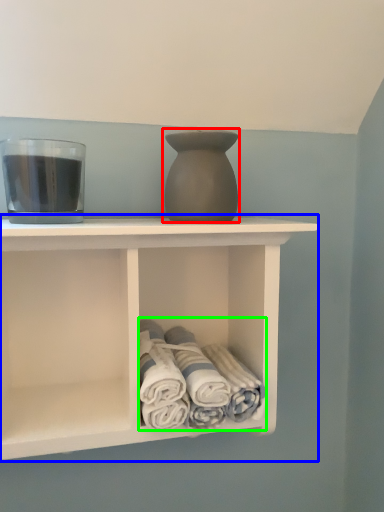
Question: Which object is the farthest from vase (highlighted by a red box)? Choose among these: shelf (highlighted by a blue box) or bath towel (highlighted by a green box).

Choices:
 (A) shelf
 (B) bath towel

Answer: (B)